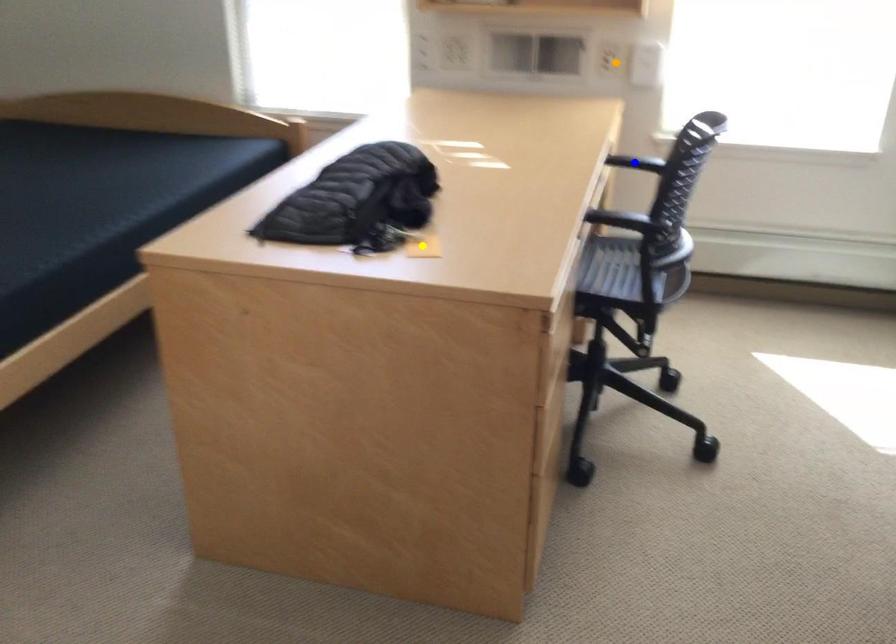
Order these from nearest to farthest:
blue point, yellow point, orange point

blue point
orange point
yellow point